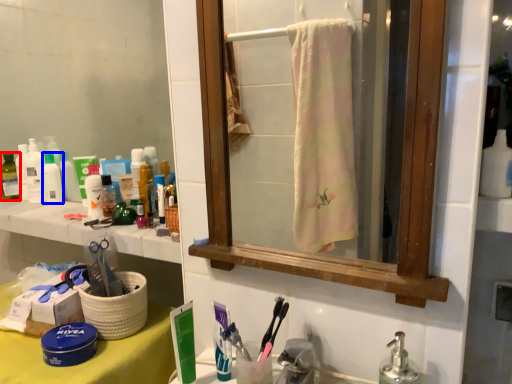
Question: Which object appears closest to the camera in this image, toiletry (highlighted by a red box) or toiletry (highlighted by a blue box)?

Choices:
 (A) toiletry
 (B) toiletry

Answer: (B)